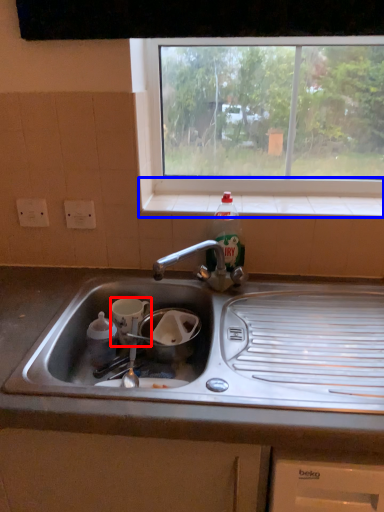
Question: Which object is further to the camera taking this photo, appliance (highlighted by a red box) or window sill (highlighted by a blue box)?

Choices:
 (A) appliance
 (B) window sill

Answer: (B)